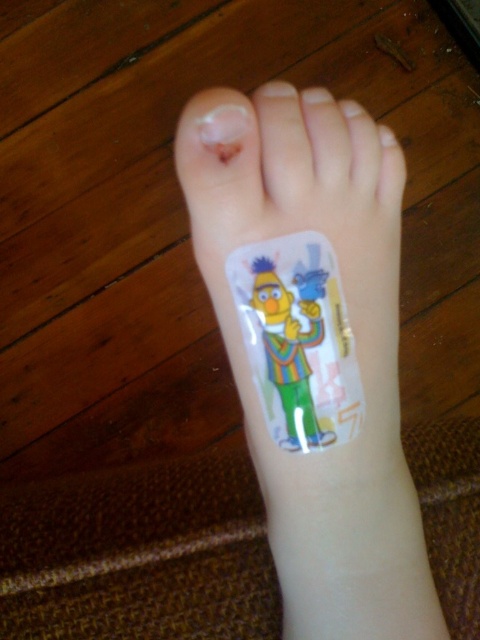
Could you measure the distance between transparent adhesive bandage at lower center and clear plastic toe at upper center?

A distance of 5.67 inches exists between transparent adhesive bandage at lower center and clear plastic toe at upper center.

Does transparent adhesive bandage at lower center have a lesser height compared to clear plastic toe at upper center?

No.

This screenshot has height=640, width=480. What do you see at coordinates (356, 355) in the screenshot?
I see `transparent adhesive bandage at lower center` at bounding box center [356, 355].

The image size is (480, 640). I want to click on transparent adhesive bandage at lower center, so click(356, 355).